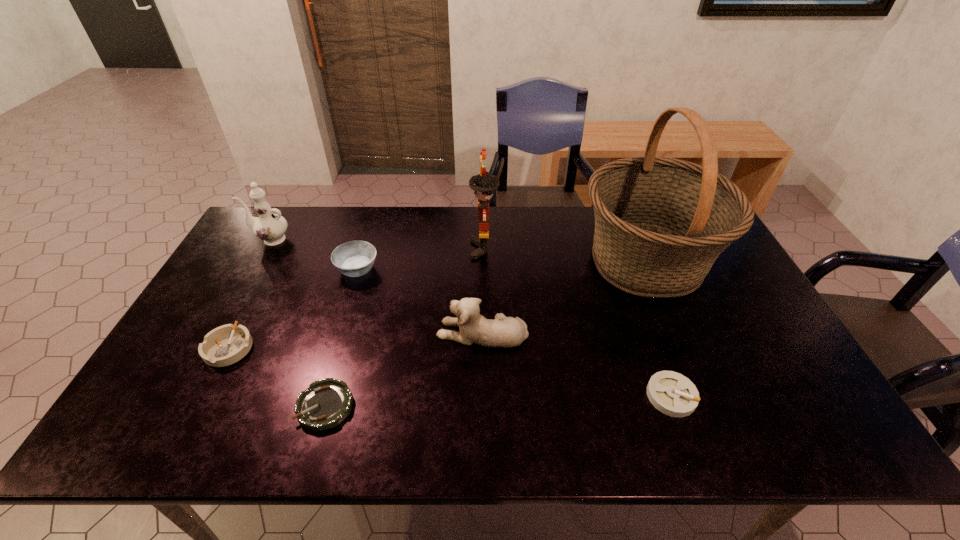
I want to click on vacant region located on the front-facing side of the nutcracker, so click(386, 249).

Identify the location of vacant region located on the front-facing side of the nutcracker. (359, 249).

Find the location of a particular element. This screenshot has width=960, height=540. blank space located 0.080m on the front-facing side of the nutcracker is located at coordinates tap(446, 249).

The width and height of the screenshot is (960, 540). Identify the location of free space located on the front-facing side of the puppy. (326, 332).

Locate an element on the screen. The image size is (960, 540). free region located on the front-facing side of the puppy is located at coordinates (403, 332).

You are a GUI agent. You are given a task and a screenshot of the screen. Output one action in this format:
    pyautogui.click(x=<x>, y=<y>)
    Task: Click on the free space located 0.190m on the front-facing side of the puppy
    This screenshot has height=540, width=960.
    Given the screenshot: What is the action you would take?
    pyautogui.click(x=367, y=332)

Locate an element on the screen. Image resolution: width=960 pixels, height=540 pixels. vacant region located on the front of the farthest ashtray is located at coordinates (340, 328).

Locate an element on the screen. The width and height of the screenshot is (960, 540). free location located on the right of the second farthest ashtray is located at coordinates (373, 348).

This screenshot has width=960, height=540. Identify the location of free location located on the left of the rightmost ashtray. (581, 396).

The image size is (960, 540). I want to click on free region located on the right of the shortest ashtray, so click(445, 406).